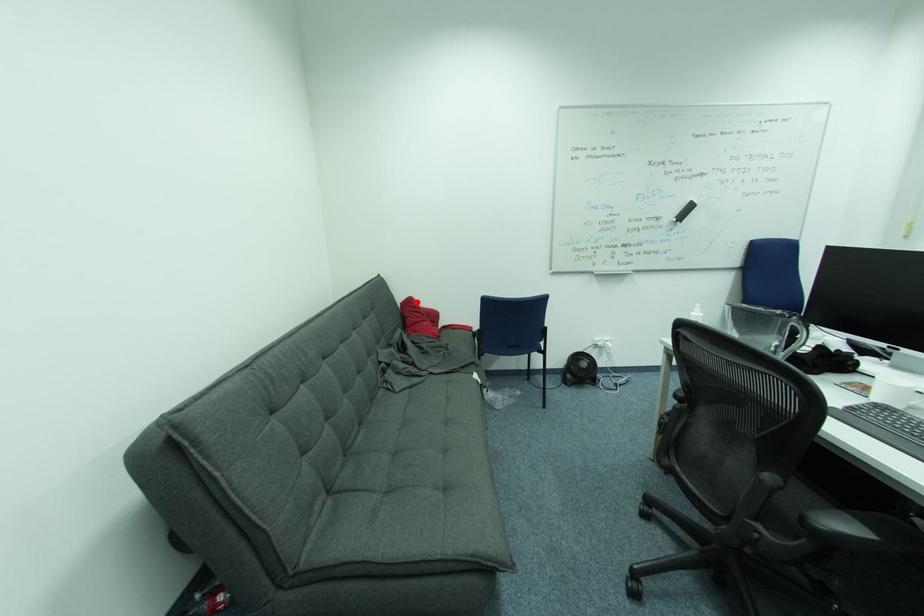
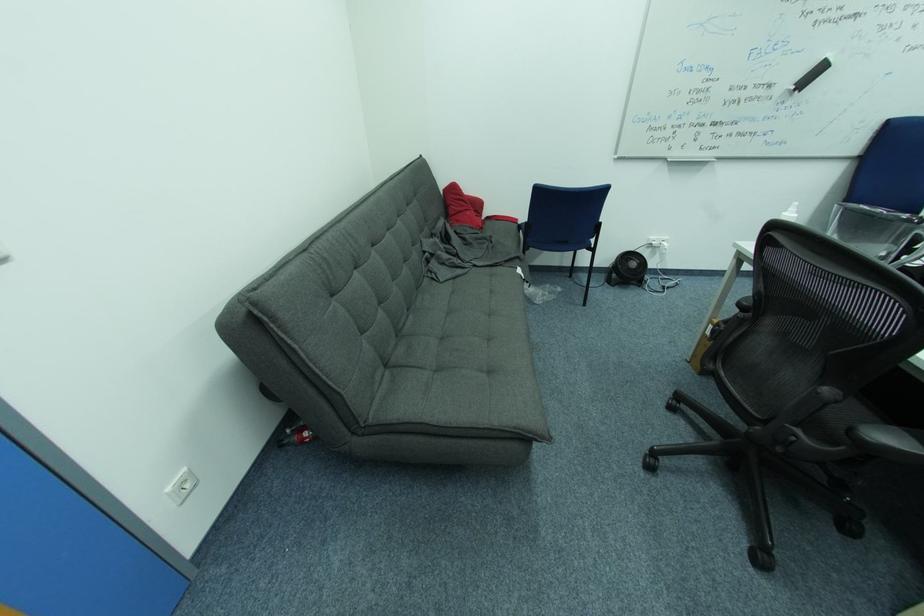
Question: I am providing you with two images of the same scene from different viewpoints. Given a red point in image1, look at the same physical point in image2. Is it:

Choices:
 (A) Closer to the viewpoint
 (B) Farther from the viewpoint

Answer: (A)